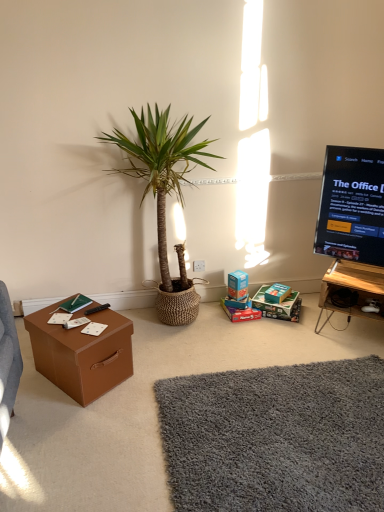
What are the coordinates of `vacant space that is in between brown cardboard box at lower left and wooden entertainment center at right` in the screenshot? It's located at (224, 350).